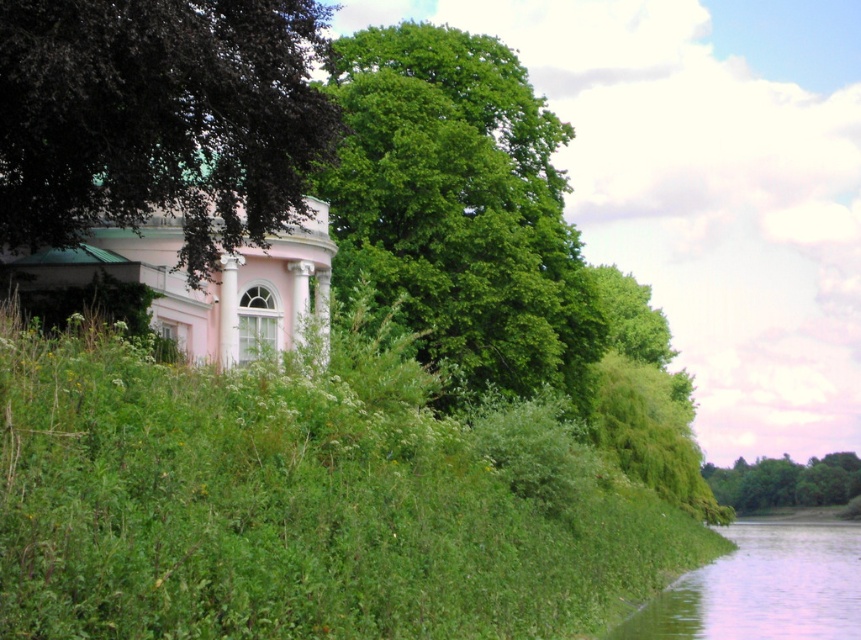
At what (x,y) coordinates should I click in order to perform the action: click on dark green leafy tree at upper left. Please return your answer as a coordinate pair (x, y). Image resolution: width=861 pixels, height=640 pixels. Looking at the image, I should click on (158, 118).

Which is behind, point (184, 68) or point (790, 566)?

The point (790, 566) is more distant.

This screenshot has height=640, width=861. Find the location of `dark green leafy tree at upper left`. dark green leafy tree at upper left is located at coordinates (158, 118).

Who is positioned more to the left, clear water at lower right or green leafy tree at lower right?

clear water at lower right

Can you confirm if clear water at lower right is positioned to the right of green leafy tree at lower right?

No, clear water at lower right is not to the right of green leafy tree at lower right.

Describe the element at coordinates (762, 588) in the screenshot. I see `clear water at lower right` at that location.

Where is `clear water at lower right`? clear water at lower right is located at coordinates (762, 588).

Which is more to the left, green leafy tree at center or green leafy tree at lower right?

Positioned to the left is green leafy tree at center.

Does point (457, 154) come in front of point (756, 486)?

That is True.

Image resolution: width=861 pixels, height=640 pixels. Identify the location of green leafy tree at center. (460, 208).